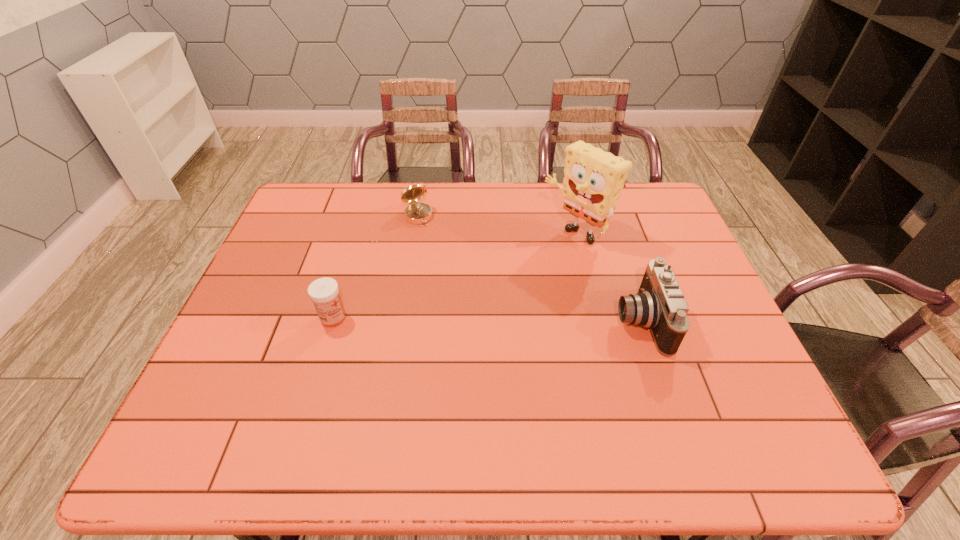
The image size is (960, 540). In order to click on vacant space situated with the dial facing the compass in this screenshot , I will do `click(461, 291)`.

Find the location of a particular element. The height and width of the screenshot is (540, 960). vacant space located 0.200m on the face of the tallest object is located at coordinates (509, 279).

You are a GUI agent. You are given a task and a screenshot of the screen. Output one action in this format:
    pyautogui.click(x=<x>, y=<y>)
    Task: Click on the vacant point located on the face of the tallest object
    The width and height of the screenshot is (960, 540).
    Given the screenshot: What is the action you would take?
    point(539,257)

Where is `free space located on the face of the tallest object`? The width and height of the screenshot is (960, 540). free space located on the face of the tallest object is located at coordinates (496, 288).

Where is `compass positioned at the far edge`? This screenshot has height=540, width=960. compass positioned at the far edge is located at coordinates (415, 213).

Where is `sponge situated at the far edge`? This screenshot has width=960, height=540. sponge situated at the far edge is located at coordinates (593, 179).

Locate an element on the screen. The width and height of the screenshot is (960, 540). object situated at the right edge is located at coordinates (659, 305).

In the image, there is a desktop. Find the location of `blank space at the far edge`. blank space at the far edge is located at coordinates (373, 211).

The width and height of the screenshot is (960, 540). Find the location of `vacant position at the near edge of the desktop`. vacant position at the near edge of the desktop is located at coordinates (424, 404).

Image resolution: width=960 pixels, height=540 pixels. I want to click on blank area at the left edge, so click(x=294, y=233).